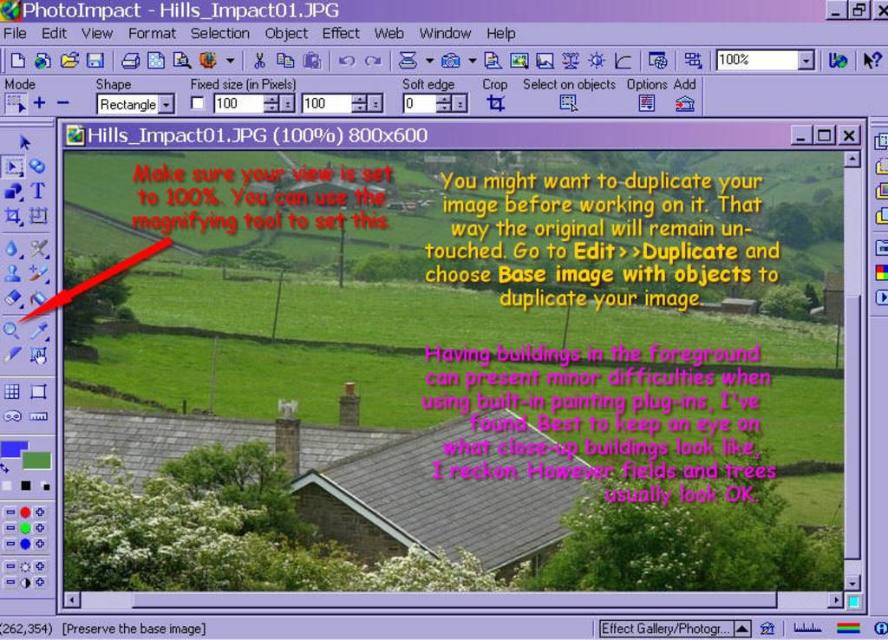
You are using PhotoImpact to edit the image of the landscape. You notice two points marked in the software. The first point is at coordinate (x=678, y=218) and the second is at (x=460, y=358). If you were to draw a straight line between them, would the line pass in front of or behind the building with the gray roof?

The line between point (x=678, y=218) and point (x=460, y=358) would pass behind the building with the gray roof because point (x=678, y=218) is behind point (x=460, y=358).

You are using PhotoImpact to edit the image of the landscape. You notice the pink paper at upper center and the red text at upper left. Which object is positioned in front of the other?

The pink paper at upper center is closer to the viewer than the red text at upper left, so it is positioned in front of the red text at upper left.